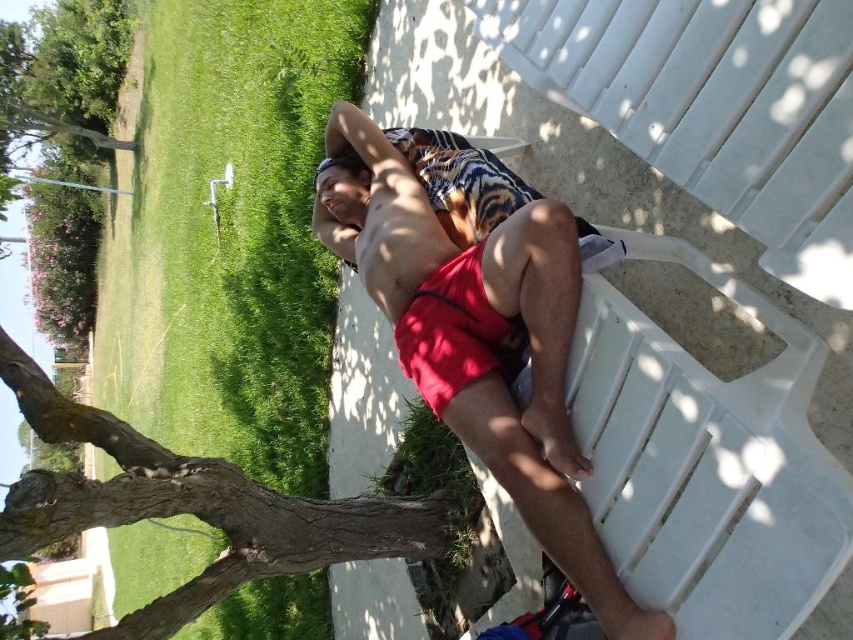
Question: Can you confirm if red fabric shorts at center is thinner than brown rough bark at lower left?

Choices:
 (A) yes
 (B) no

Answer: (A)

Question: Considering the relative positions of red fabric shorts at center and brown rough bark at lower left in the image provided, where is red fabric shorts at center located with respect to brown rough bark at lower left?

Choices:
 (A) below
 (B) above

Answer: (B)

Question: Can you confirm if red fabric shorts at center is positioned above brown rough bark at lower left?

Choices:
 (A) yes
 (B) no

Answer: (A)